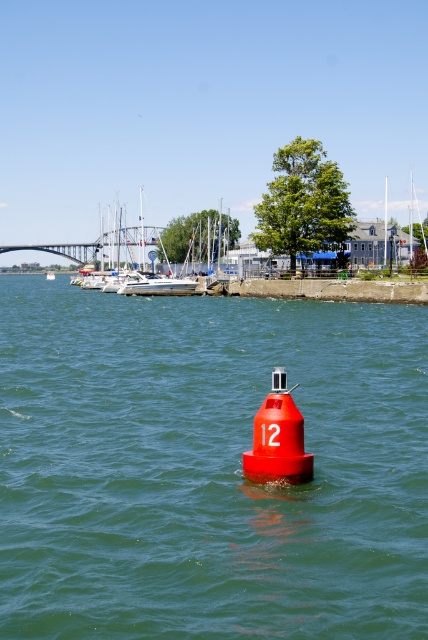
Which is above, smooth glossy buoy at center or white plastic boat at center?

white plastic boat at center

From the picture: Who is more distant from viewer, (115, 292) or (51, 273)?

The point (51, 273) is behind.

Find the location of `smooth glossy buoy at center`. smooth glossy buoy at center is located at coordinates (208, 467).